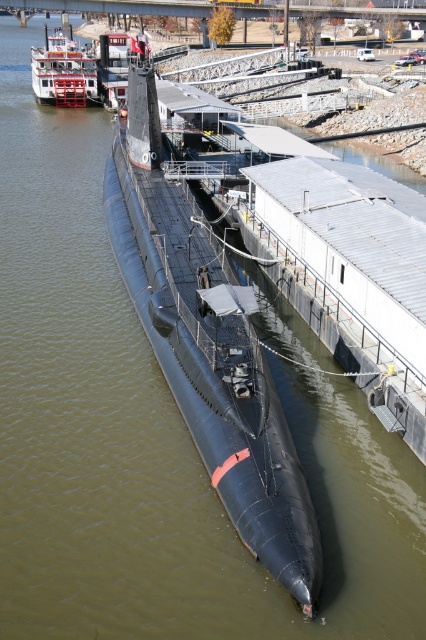
Question: Which of the following is the closest to the observer?

Choices:
 (A) (256, 472)
 (B) (60, 42)

Answer: (A)

Question: Does black rubber submarine at center have a lesser width compared to red painted wood paddlewheel boat at upper left?

Choices:
 (A) yes
 (B) no

Answer: (A)

Question: Does black rubber submarine at center appear over red painted wood paddlewheel boat at upper left?

Choices:
 (A) yes
 (B) no

Answer: (B)

Question: Does black rubber submarine at center have a lesser width compared to red painted wood paddlewheel boat at upper left?

Choices:
 (A) yes
 (B) no

Answer: (A)